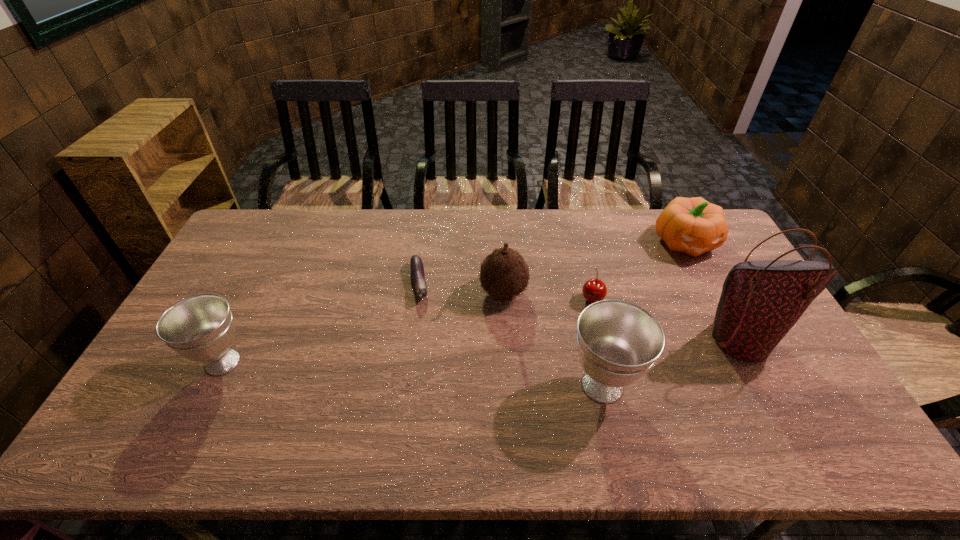
Image resolution: width=960 pixels, height=540 pixels. I want to click on blank space that satisfies the following two spatial constraints: 1. on the back side of the taller chalice; 2. on the surface of the third object from left to right, so click(x=581, y=292).

Find the location of `vacant point that satisfies the following two spatial constraints: 1. on the surface of the right chalice; 2. on the left side of the third object from left to right`. vacant point that satisfies the following two spatial constraints: 1. on the surface of the right chalice; 2. on the left side of the third object from left to right is located at coordinates (509, 386).

Where is `vacant space that satisfies the following two spatial constraints: 1. on the front side of the sixth object from right to left; 2. on the right side of the cherry`? The height and width of the screenshot is (540, 960). vacant space that satisfies the following two spatial constraints: 1. on the front side of the sixth object from right to left; 2. on the right side of the cherry is located at coordinates (418, 298).

Where is `vacant space that satisfies the following two spatial constraints: 1. on the front side of the taller chalice; 2. on the right side of the shortest object`? vacant space that satisfies the following two spatial constraints: 1. on the front side of the taller chalice; 2. on the right side of the shortest object is located at coordinates (405, 386).

Locate an element on the screen. The height and width of the screenshot is (540, 960). vacant space that satisfies the following two spatial constraints: 1. on the carved face of the pumpkin; 2. on the surface of the coconut is located at coordinates (711, 292).